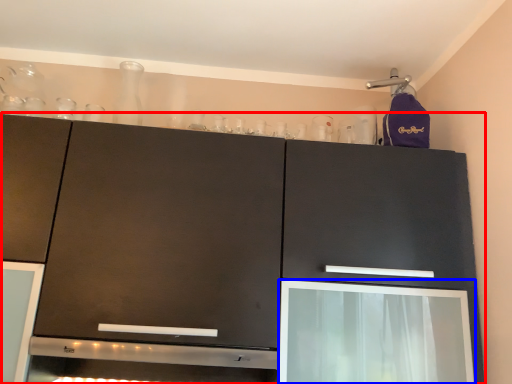
Question: Among these objects, which one is farthest to the camera, cabinetry (highlighted by a red box) or screen door (highlighted by a blue box)?

Choices:
 (A) cabinetry
 (B) screen door

Answer: (B)